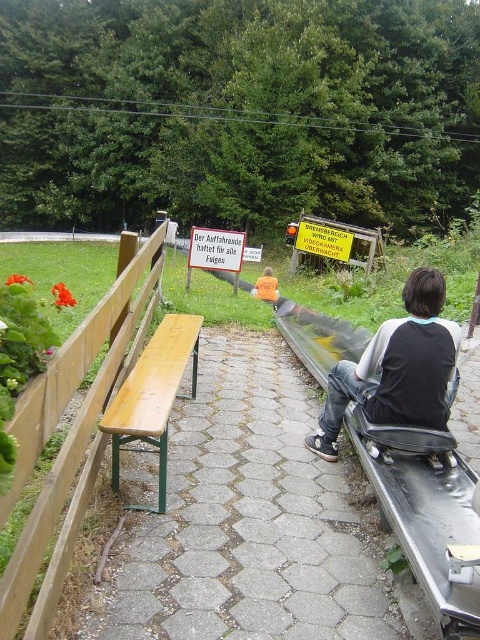
You are standing at the start of the pathway and see both the white paper sign at center and the yellow plastic sign at center ahead of you. Which sign is shorter?

The white paper sign at center is shorter than the yellow plastic sign at center.